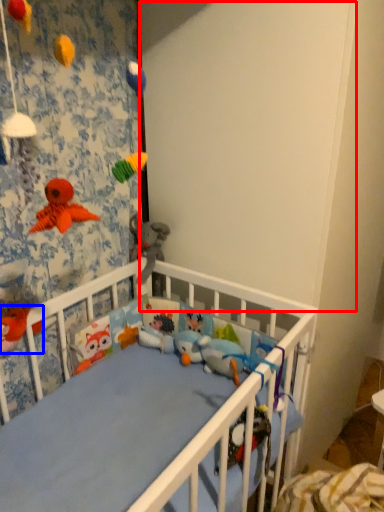
Question: Which object appears closest to the camera in this image, backdrop (highlighted by a red box) or toy (highlighted by a blue box)?

Choices:
 (A) backdrop
 (B) toy

Answer: (A)